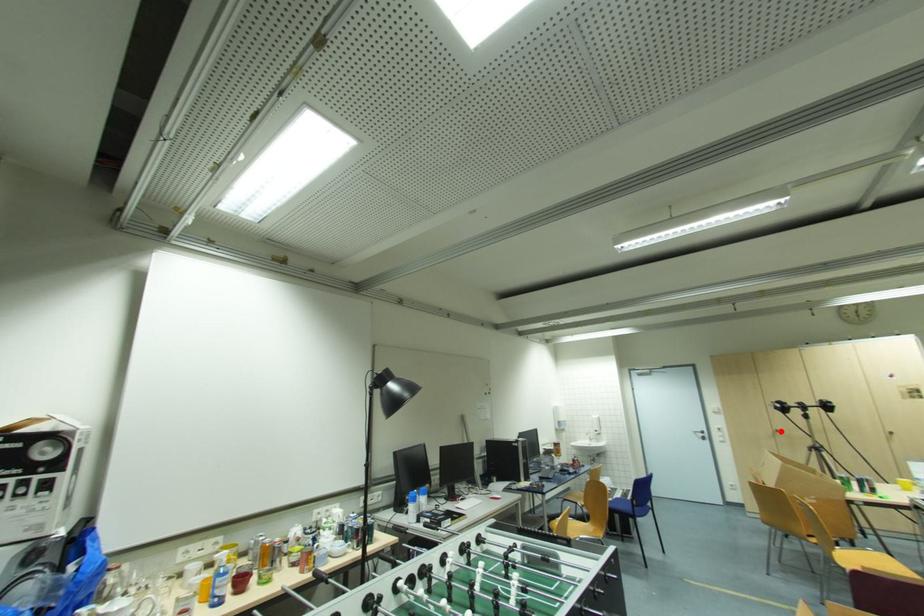
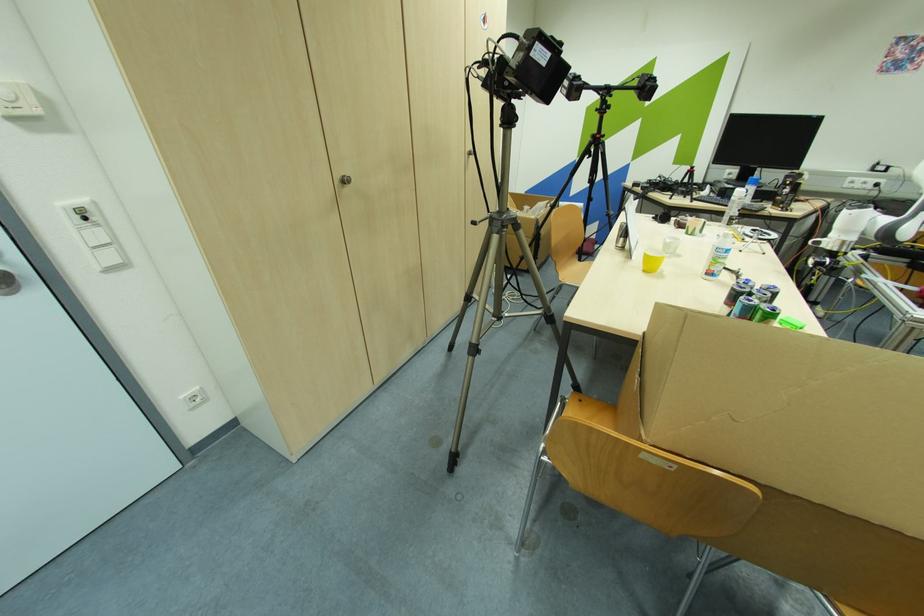
The point at the highlighted location is marked in the first image. Where is the corresponding point in the second image?

(348, 182)